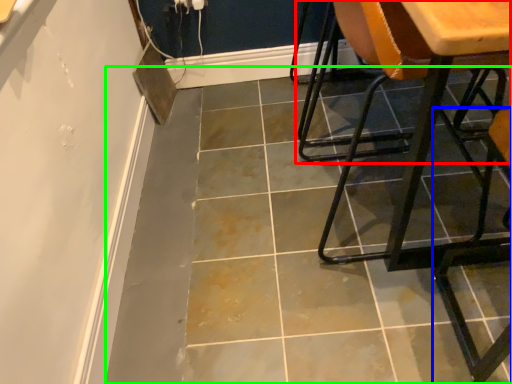
Question: Based on their relative distances, which object is farther from chair (highlighted by a red box)? Choose from chair (highlighted by a blue box) and concrete (highlighted by a green box).

Choices:
 (A) chair
 (B) concrete

Answer: (A)